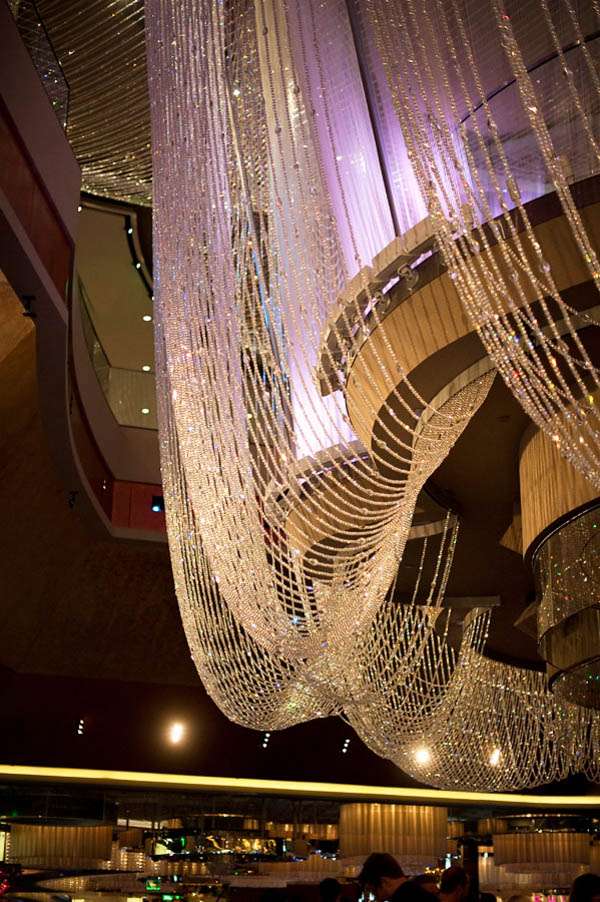
Identify the location of chandeliers. (469, 726), (266, 677), (258, 600), (532, 274), (100, 97).